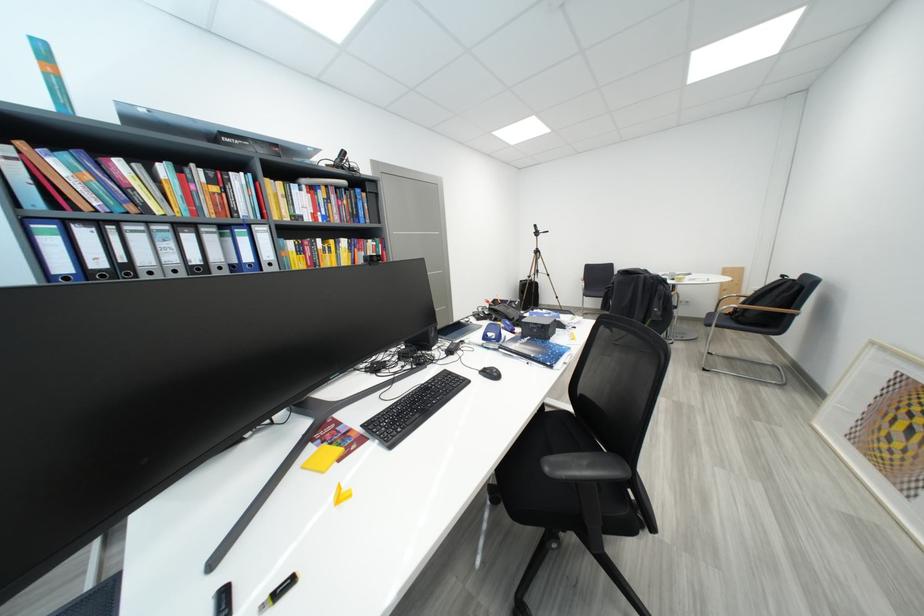
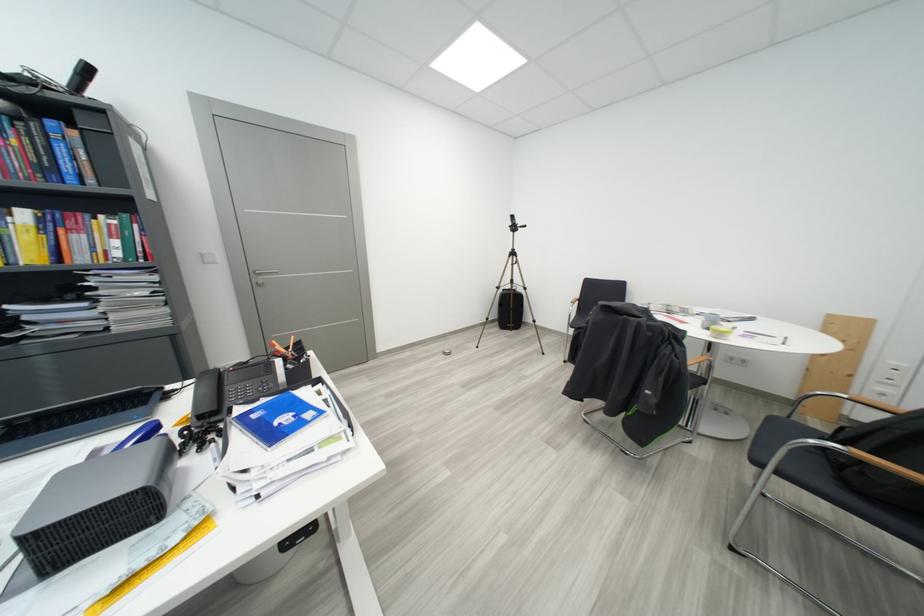
Locate, in the second image, the point that corresponds to point (748, 325) in the first image.

(856, 487)